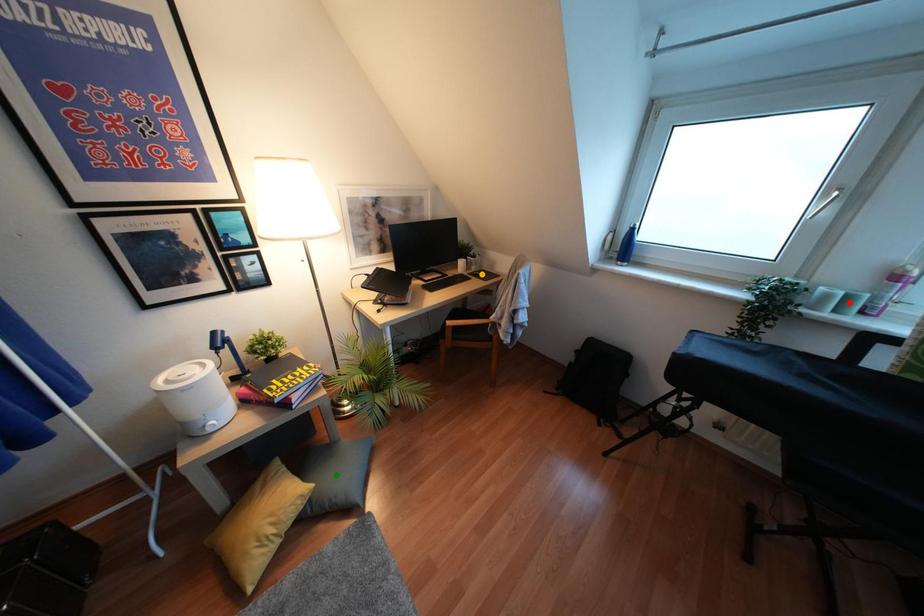
Order these from farthest to nearest:
1. red point
2. orange point
3. green point

orange point, green point, red point